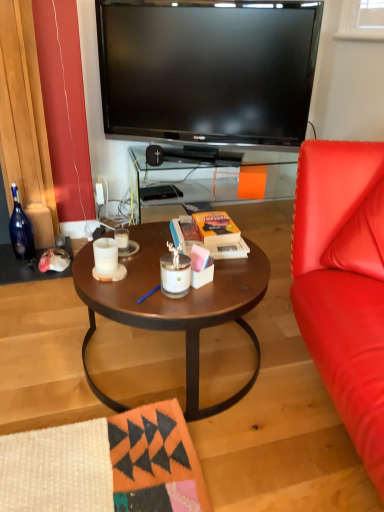
Identify the location of orange matte book at center. (202, 240).

Describe the element at coordinates (154, 155) in the screenshot. I see `black plastic speaker at center` at that location.

Image resolution: width=384 pixels, height=512 pixels. In order to click on blue glass bottle at left in this screenshot , I will do `click(21, 230)`.

What do you see at coordinates (21, 230) in the screenshot?
I see `blue glass bottle at left` at bounding box center [21, 230].

Measure the distance between matte brown coffee table at center and camera.

matte brown coffee table at center and camera are 1.12 meters apart.

The height and width of the screenshot is (512, 384). What are the coordinates of `orange matte book at center` in the screenshot? It's located at (202, 240).

Between black plastic speaker at center and blue glass bottle at left, which one has smaller size?

With smaller size is black plastic speaker at center.

Find the location of a particular element. speaker behind the blue glass bottle at left is located at coordinates (154, 155).

Is black plastic speaker at center at the left side of blue glass bottle at left?

No, black plastic speaker at center is not to the left of blue glass bottle at left.

How different are the orientations of black plastic speaker at center and blue glass bottle at left in degrees?

The facing directions of black plastic speaker at center and blue glass bottle at left are 0.679 degrees apart.

Consider the image. From the image's perspective, is white matte candle at center, which appears as the first coffee cup when viewed from the front, over wooden table at center?

No, from the image's perspective, white matte candle at center, which appears as the first coffee cup when viewed from the front, is not above wooden table at center.

Looking at the image, does white matte candle at center, placed as the second coffee cup when sorted from back to front, seem bigger or smaller compared to wooden table at center?

Clearly, white matte candle at center, placed as the second coffee cup when sorted from back to front, is smaller in size than wooden table at center.

You are a GUI agent. You are given a task and a screenshot of the screen. Output one action in this format:
    pyautogui.click(x=<x>, y=<y>)
    Task: Click on the desk directly beneath the white matte candle at center, placed as the second coffee cup when sorted from back to front (from a real-world perspective)
    Image resolution: width=384 pixels, height=512 pixels.
    Given the screenshot: What is the action you would take?
    pyautogui.click(x=208, y=182)

Is point (146, 157) in front of point (263, 272)?

No, it is not.

Consider the image. Between black plastic speaker at center and matte brown coffee table at center, which one has less height?

Standing shorter between the two is black plastic speaker at center.

From a real-world perspective, is black plastic speaker at center on matte brown coffee table at center?

Yes, from a real-world perspective, black plastic speaker at center is on top of matte brown coffee table at center.

Are matte brown coffee table at center and orange matte book at center far apart?

matte brown coffee table at center is actually quite close to orange matte book at center.

From a real-world perspective, between matte brown coffee table at center and orange matte book at center, who is vertically lower?

From a 3D spatial view, matte brown coffee table at center is below.

Between matte brown coffee table at center and orange matte book at center, which one has less height?

orange matte book at center.

Considering the relative sizes of blue glass bottle at left and orange matte book at center in the image provided, is blue glass bottle at left thinner than orange matte book at center?

Yes, blue glass bottle at left is thinner than orange matte book at center.

Between blue glass bottle at left and orange matte book at center, which one is positioned in front?

orange matte book at center is closer to the camera.

Is blue glass bottle at left taller or shorter than orange matte book at center?

blue glass bottle at left is taller than orange matte book at center.

Considering the positions of points (21, 232) and (222, 247), is point (21, 232) farther from camera compared to point (222, 247)?

Yes, point (21, 232) is farther from viewer.

Considering the relative sizes of blue glass bottle at left and white matte candle at center, which appears as the first coffee cup when viewed from the front, in the image provided, is blue glass bottle at left taller than white matte candle at center, which appears as the first coffee cup when viewed from the front,?

Indeed, blue glass bottle at left has a greater height compared to white matte candle at center, which appears as the first coffee cup when viewed from the front.

From the image's perspective, is blue glass bottle at left under white matte candle at center, placed as the second coffee cup when sorted from back to front?

No, from the image's perspective, blue glass bottle at left is not beneath white matte candle at center, placed as the second coffee cup when sorted from back to front.

Which object is wider, orange matte book at center or white matte candle at center, which appears as the first coffee cup when viewed from the front?

orange matte book at center.

Considering the relative sizes of orange matte book at center and white matte candle at center, which appears as the first coffee cup when viewed from the front, in the image provided, is orange matte book at center taller than white matte candle at center, which appears as the first coffee cup when viewed from the front,?

Indeed, orange matte book at center has a greater height compared to white matte candle at center, which appears as the first coffee cup when viewed from the front.

From a real-world perspective, is orange matte book at center on top of white matte candle at center, which appears as the first coffee cup when viewed from the front?

No, from a real-world perspective, orange matte book at center is not above white matte candle at center, which appears as the first coffee cup when viewed from the front.

Is orange matte book at center turned away from white matte candle at center, placed as the second coffee cup when sorted from back to front?

orange matte book at center is not turned away from white matte candle at center, placed as the second coffee cup when sorted from back to front.

The image size is (384, 512). I want to click on bottle in front of the black plastic speaker at center, so click(21, 230).

At what (x,y) coordinates should I click in order to perform the action: click on desk beneath the white matte candle at center, placed as the second coffee cup when sorted from back to front (from a real-world perspective). Please return your answer as a coordinate pair (x, y). Image resolution: width=384 pixels, height=512 pixels. Looking at the image, I should click on tap(208, 182).

When comparing their distances from blue glass bottle at left, does matte brown coffee table at center or wooden table at center seem closer?

The object closer to blue glass bottle at left is wooden table at center.

Based on their spatial positions, is white matte candle at center, which is counted as the 1th coffee cup, starting from the back, or white matte candle at center, which appears as the first coffee cup when viewed from the front, further from black plastic speaker at center?

white matte candle at center, which appears as the first coffee cup when viewed from the front.

Considering their positions, is black plastic speaker at center positioned closer to blue glass bottle at left than white matte candle at center, which is counted as the 1th coffee cup, starting from the back?

white matte candle at center, which is counted as the 1th coffee cup, starting from the back.

Based on their spatial positions, is blue glass bottle at left or matte brown coffee table at center closer to wooden table at center?

The object closer to wooden table at center is blue glass bottle at left.

From the image, which object appears to be nearer to orange matte book at center, matte brown coffee table at center or white matte candle at center, the second coffee cup when ordered from front to back?

matte brown coffee table at center is closer to orange matte book at center.

When comparing their distances from matte brown coffee table at center, does orange matte book at center or wooden table at center seem further?

wooden table at center.

Looking at the image, which one is located closer to white matte candle at center, which appears as the first coffee cup when viewed from the front, matte brown coffee table at center or orange matte book at center?

The object closer to white matte candle at center, which appears as the first coffee cup when viewed from the front, is matte brown coffee table at center.

Considering their positions, is white matte candle at center, placed as the second coffee cup when sorted from back to front, positioned further to orange matte book at center than black plastic speaker at center?

Among the two, black plastic speaker at center is located further to orange matte book at center.

At what (x,y) coordinates should I click in order to perform the action: click on magazine between blue glass bottle at left and wooden table at center in the horizontal direction. Please return your answer as a coordinate pair (x, y). Looking at the image, I should click on [202, 240].

You are a GUI agent. You are given a task and a screenshot of the screen. Output one action in this format:
    pyautogui.click(x=<x>, y=<y>)
    Task: Click on the coffee cup between matte brown coffee table at center and white matte candle at center, which is counted as the 1th coffee cup, starting from the back, from front to back
    
    Given the screenshot: What is the action you would take?
    pyautogui.click(x=105, y=255)

Where is `bottle located between white matte candle at center, placed as the second coffee cup when sorted from back to front, and wooden table at center in the depth direction`? This screenshot has width=384, height=512. bottle located between white matte candle at center, placed as the second coffee cup when sorted from back to front, and wooden table at center in the depth direction is located at coordinates (21, 230).

Where is `bottle between white matte candle at center, placed as the second coffee cup when sorted from back to front, and black plastic speaker at center from front to back`? bottle between white matte candle at center, placed as the second coffee cup when sorted from back to front, and black plastic speaker at center from front to back is located at coordinates (21, 230).